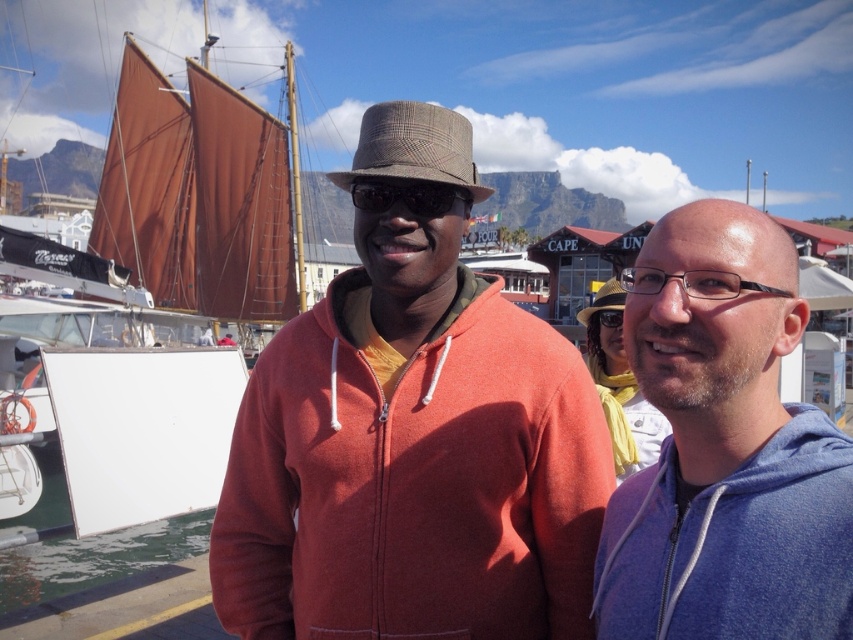
Does blue fleece jacket at right come behind brown textured hat at center?

No, it is in front of brown textured hat at center.

Does blue fleece jacket at right have a lesser width compared to brown textured hat at center?

Indeed, blue fleece jacket at right has a lesser width compared to brown textured hat at center.

Image resolution: width=853 pixels, height=640 pixels. Describe the element at coordinates (724, 449) in the screenshot. I see `blue fleece jacket at right` at that location.

Where is `blue fleece jacket at right`? The width and height of the screenshot is (853, 640). blue fleece jacket at right is located at coordinates (724, 449).

Which is more to the left, brown canvas sailboat at left or black plastic goggles at center?

brown canvas sailboat at left is more to the left.

Is the position of brown canvas sailboat at left less distant than that of black plastic goggles at center?

That is False.

The image size is (853, 640). Find the location of `brown canvas sailboat at left`. brown canvas sailboat at left is located at coordinates (202, 195).

Between green glossy water at lower left and black plastic goggles at center, which one appears on the right side from the viewer's perspective?

Positioned to the right is black plastic goggles at center.

Can you confirm if green glossy water at lower left is shorter than black plastic goggles at center?

Yes, green glossy water at lower left is shorter than black plastic goggles at center.

Locate an element on the screen. The image size is (853, 640). green glossy water at lower left is located at coordinates (96, 557).